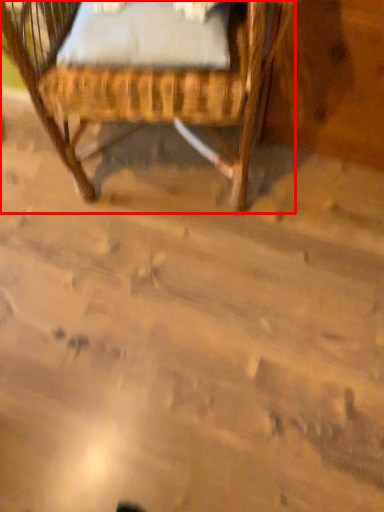
Question: From the image's perspective, where is chair (annotated by the red box) located relative to sheet?

Choices:
 (A) above
 (B) below

Answer: (A)